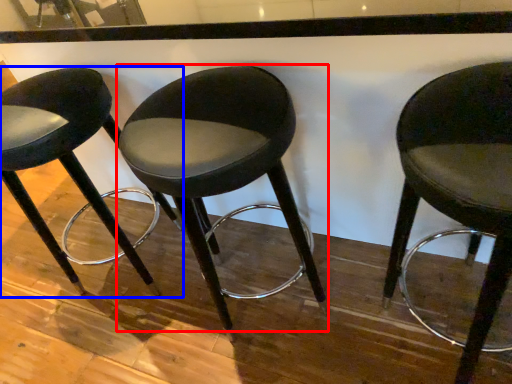
Question: Which object is further to the camera taking this photo, chair (highlighted by a red box) or chair (highlighted by a blue box)?

Choices:
 (A) chair
 (B) chair

Answer: (B)